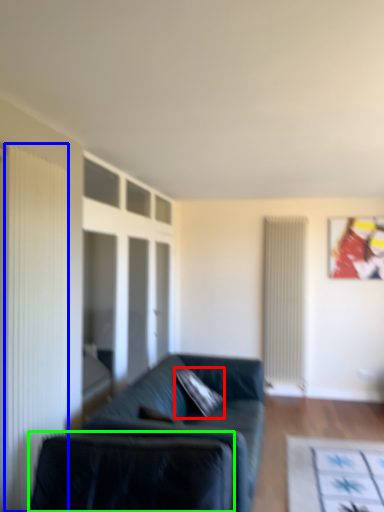
Question: Which object is the farthest from pillow (highlighted by a red box)? Choose among these: curtain (highlighted by a blue box) or swivel chair (highlighted by a green box).

Choices:
 (A) curtain
 (B) swivel chair

Answer: (A)